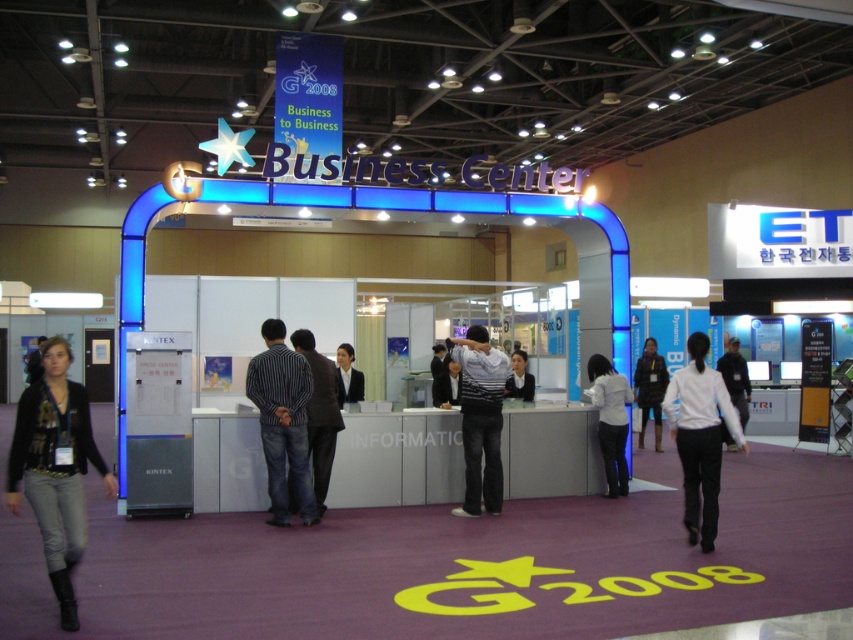
Can you confirm if denim jeans at lower left is taller than dark brown leather jacket at center?

No, denim jeans at lower left is not taller than dark brown leather jacket at center.

Who is positioned more to the right, denim jeans at lower left or dark brown leather jacket at center?

Positioned to the right is dark brown leather jacket at center.

Between point (16, 451) and point (648, 349), which one is positioned behind?

Point (648, 349)

Find the location of a particular element. Image resolution: width=853 pixels, height=640 pixels. denim jeans at lower left is located at coordinates (55, 467).

Can you confirm if striped sweater at center is positioned to the right of dark brown leather jacket at center?

Incorrect, striped sweater at center is not on the right side of dark brown leather jacket at center.

Is the position of striped sweater at center less distant than that of dark brown leather jacket at center?

That is True.

Is point (496, 408) positioned before point (654, 397)?

Yes, it is.

Where is `striped sweater at center`? The height and width of the screenshot is (640, 853). striped sweater at center is located at coordinates (479, 417).

Which is behind, point (78, 412) or point (314, 433)?

The point (314, 433) is behind.

Is denim jeans at lower left positioned at the back of dark blue jeans at center?

No.

Locate an element on the screen. denim jeans at lower left is located at coordinates (55, 467).